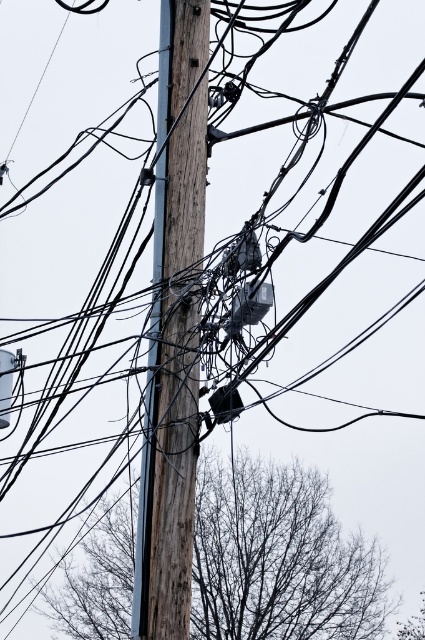
Is bare branches at lower center thinner than wooden telegraph pole at center?

Correct, bare branches at lower center's width is less than wooden telegraph pole at center's.

Describe the element at coordinates (278, 557) in the screenshot. I see `bare branches at lower center` at that location.

Is point (340, 612) in front of point (181, 593)?

No, (340, 612) is behind (181, 593).

Image resolution: width=425 pixels, height=640 pixels. What are the coordinates of `bare branches at lower center` in the screenshot? It's located at (278, 557).